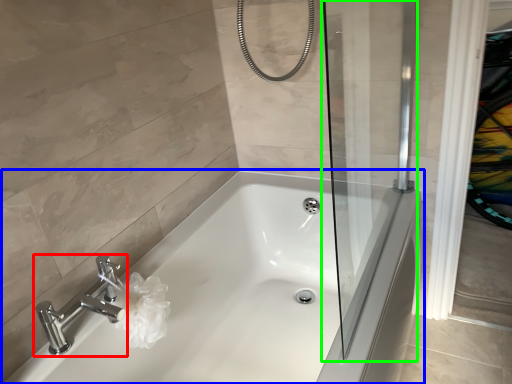
Question: Estimate the real-world distances between objects in this image. Which object is closer to tap (highlighted by a red box), bathtub (highlighted by a blue box) or screen door (highlighted by a green box)?

Choices:
 (A) bathtub
 (B) screen door

Answer: (A)